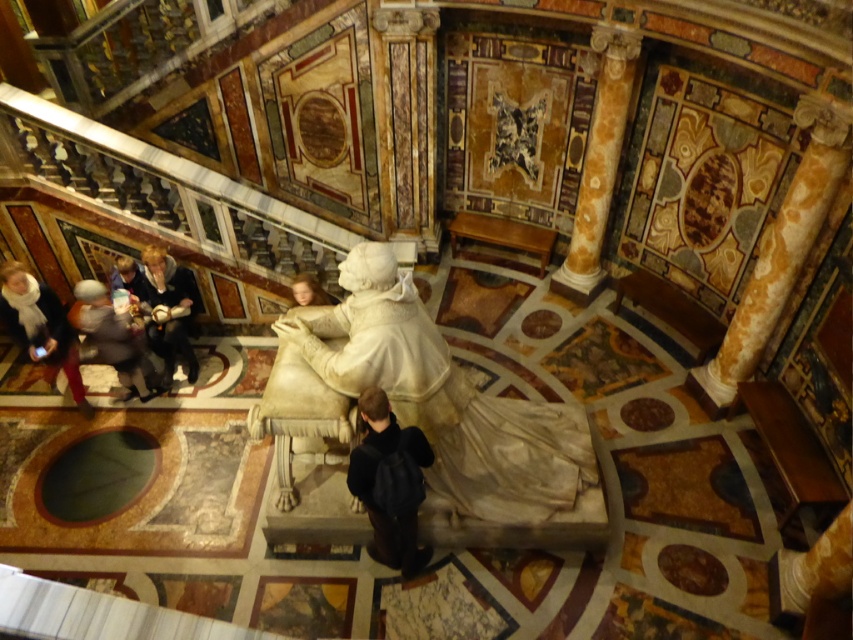
Question: Which of the following is the closest to the observer?

Choices:
 (A) (486, 432)
 (B) (30, 356)
 (C) (410, 522)
 (D) (119, 336)

Answer: (C)

Question: Is marble column at upper right wider than white scarf at lower left?

Choices:
 (A) yes
 (B) no

Answer: (A)

Question: Can you confirm if white scarf at lower left is wider than light brown leather jacket at lower left?

Choices:
 (A) no
 (B) yes

Answer: (B)

Question: Considering the real-world distances, which object is closest to the black leather backpack at center?

Choices:
 (A) light brown leather jacket at lower left
 (B) white marble statue at center

Answer: (B)

Question: Considering the relative positions of white marble statue at center and marble column at upper right in the image provided, where is white marble statue at center located with respect to marble column at upper right?

Choices:
 (A) above
 (B) below

Answer: (B)

Question: Which point appears closest to the camera in this image?

Choices:
 (A) (167, 268)
 (B) (628, 99)
 (C) (80, 394)

Answer: (A)